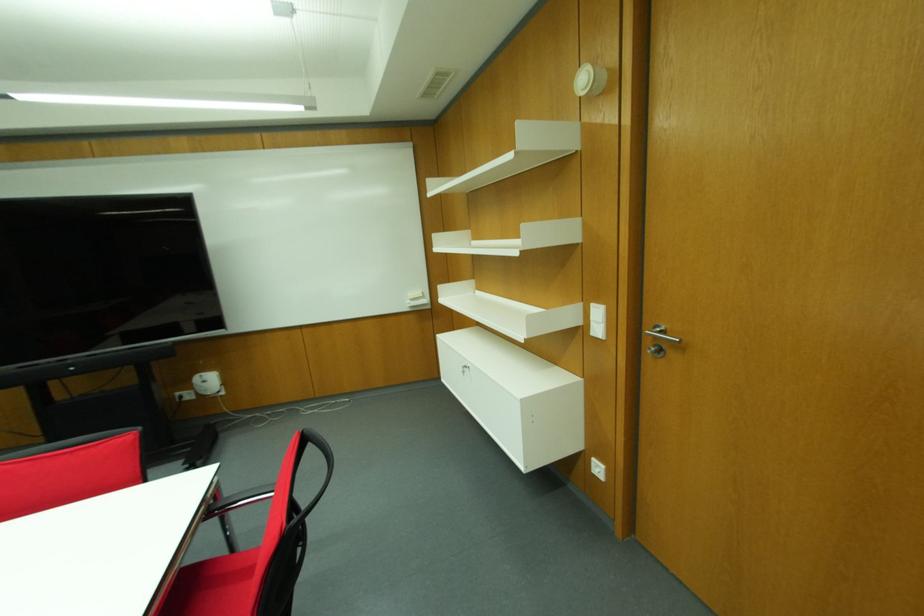
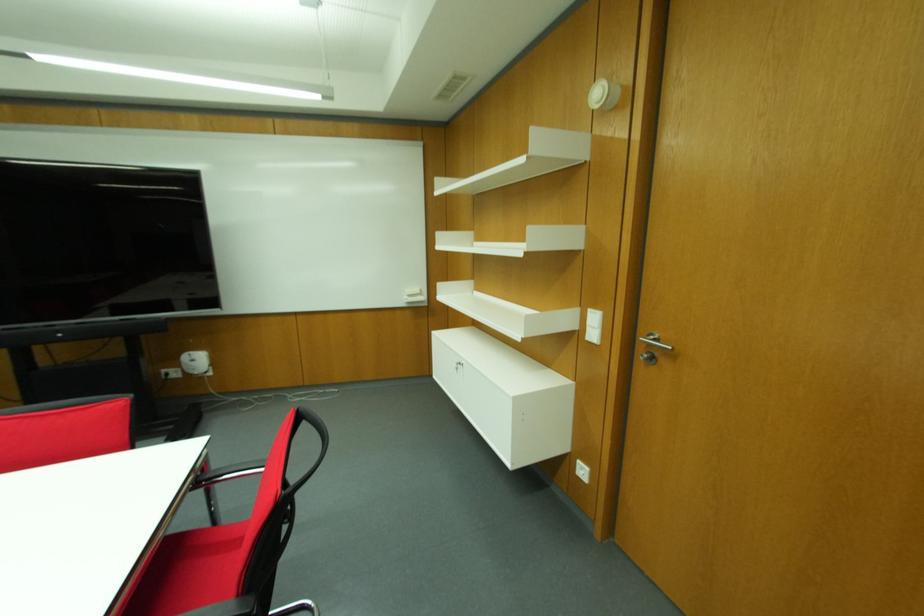
Find the pixel in the second image that matches pixel 180 397 in the first image.

(166, 374)